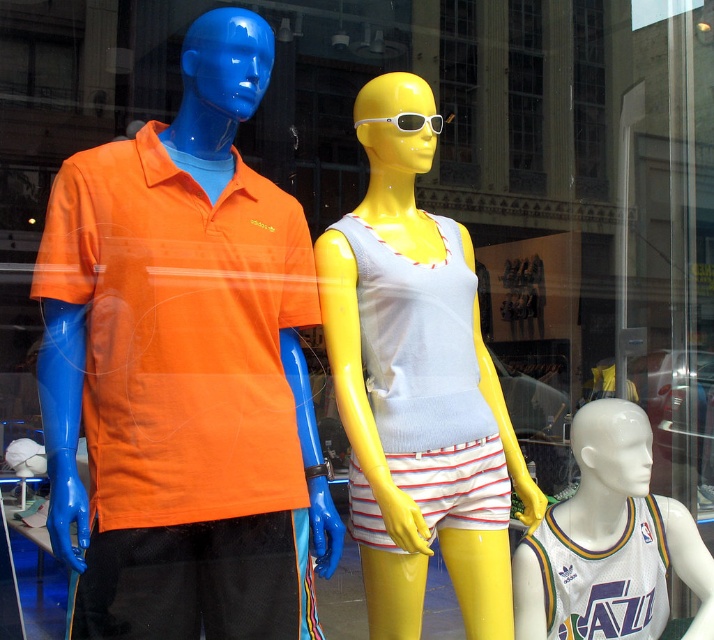
You are a customer looking at the store window. You see the white jersey at lower right and the white plastic sunglasses at center. Which item is located more to the right?

The white jersey at lower right is more to the right than the white plastic sunglasses at center.

You are a customer in the store looking at the mannequins. The store has a small entrance that is 1.2 meters wide. You want to enter the store while avoiding bumping into the matte orange polo shirt at left and the matte yellow mannequin at center. Can you fit through the entrance without touching either object?

The matte orange polo shirt at left has a smaller size compared to the matte yellow mannequin at center, but the entrance is 1.2 meters wide. Since the objects are positioned in the store window and not blocking the entrance, you can safely pass through the entrance without touching either object.